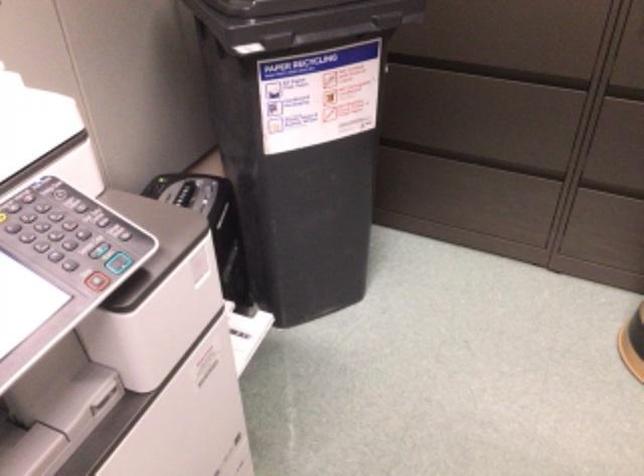
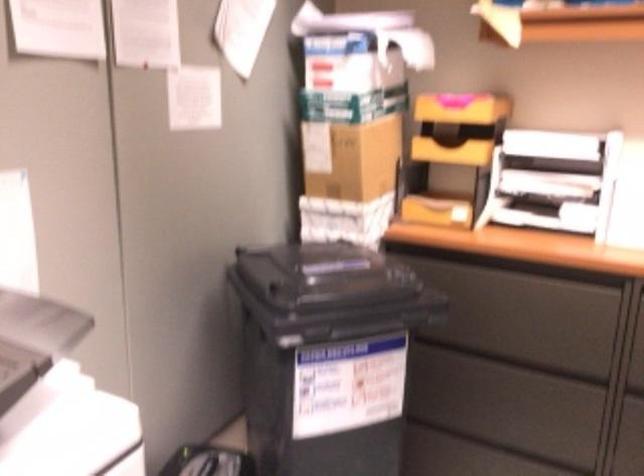
Question: Which direction would the cameraman need to move to produce the second image? Reply with the corresponding letter.

Choices:
 (A) Left
 (B) Right
 (C) Forward
 (D) Backward

Answer: (D)